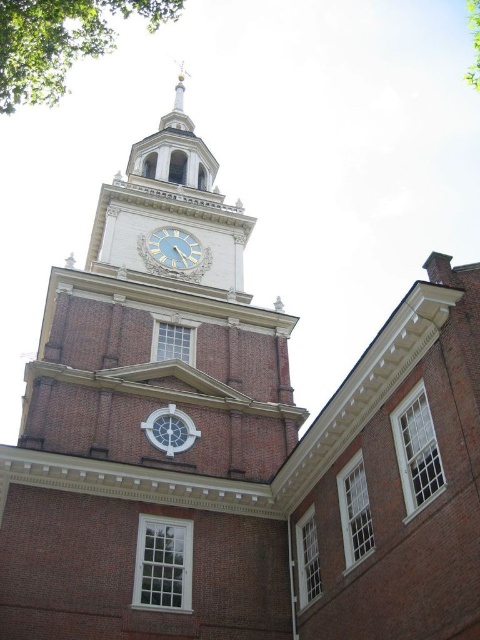
Question: Which point appears closest to the camera in this image?

Choices:
 (A) (107, 48)
 (B) (475, 68)
 (C) (177, 244)

Answer: (C)

Question: Does gold-toned metal clock at center come in front of green leafy tree at upper right?

Choices:
 (A) no
 (B) yes

Answer: (B)

Question: Which point is farther to the camera?

Choices:
 (A) (35, 104)
 (B) (171, 262)
 (C) (472, 1)

Answer: (C)

Question: Which object is the closest to the green leafy tree at upper left?

Choices:
 (A) green leafy tree at upper right
 (B) gold-toned metal clock at center

Answer: (B)

Question: Can you confirm if green leafy tree at upper left is bigger than green leafy tree at upper right?

Choices:
 (A) yes
 (B) no

Answer: (A)

Question: Can you confirm if green leafy tree at upper left is smaller than green leafy tree at upper right?

Choices:
 (A) no
 (B) yes

Answer: (A)